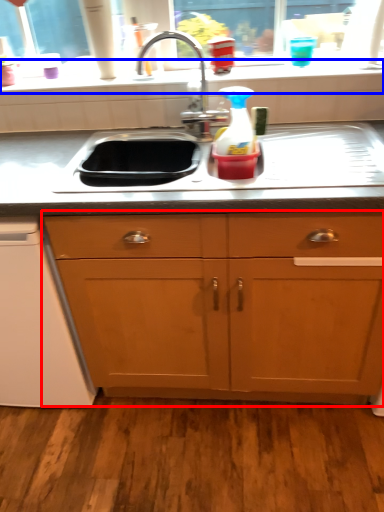
Question: Which point is further to the camera, cabinetry (highlighted by a red box) or window sill (highlighted by a blue box)?

Choices:
 (A) cabinetry
 (B) window sill

Answer: (B)